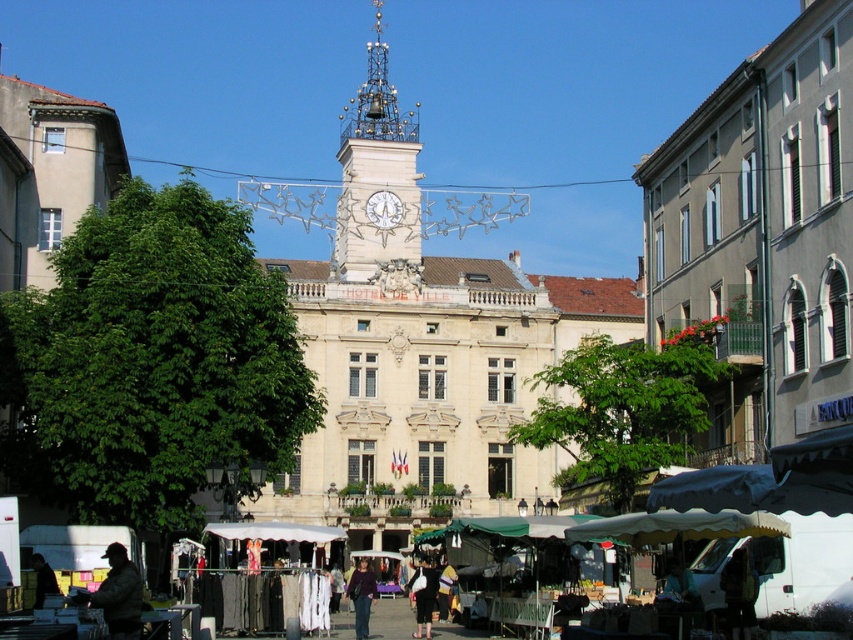
Can you confirm if polished brass clock tower at center is shorter than dark brown leather jacket at lower left?

In fact, polished brass clock tower at center may be taller than dark brown leather jacket at lower left.

Can you confirm if polished brass clock tower at center is positioned below dark brown leather jacket at lower left?

Actually, polished brass clock tower at center is above dark brown leather jacket at lower left.

Does point (392, 168) come behind point (38, 582)?

Yes, it is behind point (38, 582).

At what (x,y) coordinates should I click in order to perform the action: click on polished brass clock tower at center. Please return your answer as a coordinate pair (x, y). Looking at the image, I should click on (376, 173).

Can you confirm if polished brass clock tower at center is positioned to the left of black fabric dress at center?

Correct, you'll find polished brass clock tower at center to the left of black fabric dress at center.

Which is in front, point (363, 115) or point (432, 589)?

Point (432, 589) is more forward.

Locate an element on the screen. This screenshot has width=853, height=640. polished brass clock tower at center is located at coordinates pos(376,173).

Is black fabric dress at center positioned behind white clock face at center?

No.

Can you confirm if black fabric dress at center is wider than white clock face at center?

In fact, black fabric dress at center might be narrower than white clock face at center.

Who is more forward, (x=433, y=580) or (x=401, y=204)?

Positioned in front is point (x=433, y=580).

Image resolution: width=853 pixels, height=640 pixels. In order to click on black fabric dress at center in this screenshot , I will do `click(422, 596)`.